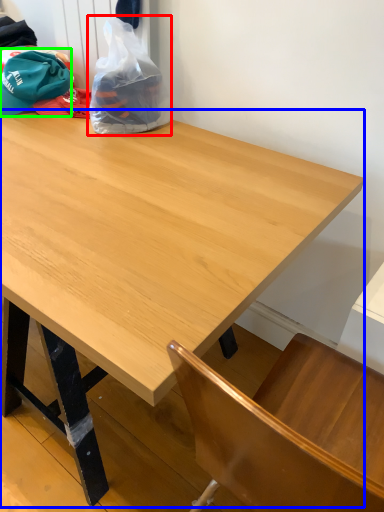
Question: Which object is the farthest from plastic bag (highlighted by a red box)? Choose among these: table (highlighted by a blue box) or baseball hat (highlighted by a green box).

Choices:
 (A) table
 (B) baseball hat

Answer: (A)